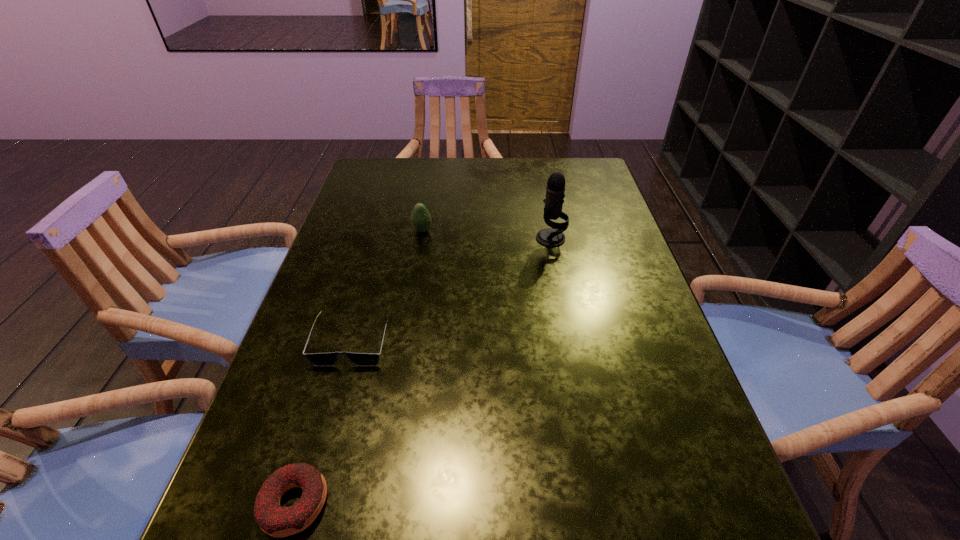
At what (x,y) coordinates should I click in order to perform the action: click on vacant area that lies between the sunglasses and the microphone. Please return your answer as a coordinate pair (x, y). Looking at the image, I should click on (451, 289).

You are a GUI agent. You are given a task and a screenshot of the screen. Output one action in this format:
    pyautogui.click(x=<x>, y=<y>)
    Task: Click on the object that stands as the closest to the sunglasses
    This screenshot has width=960, height=540.
    Given the screenshot: What is the action you would take?
    pyautogui.click(x=277, y=521)

Point out which object is positioned as the third nearest to the doughnut. Please provide its 2D coordinates. Your answer should be formatted as a tuple, i.e. [(x, y)], where the tuple contains the x and y coordinates of a point satisfying the conditions above.

[(551, 237)]